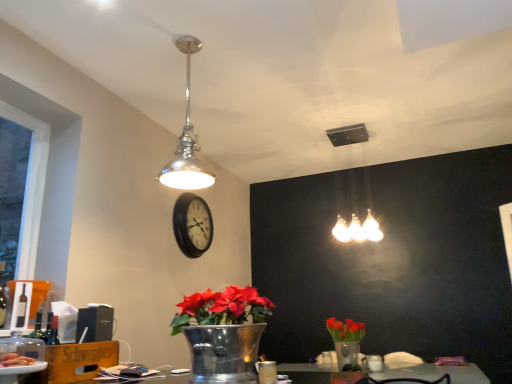
The height and width of the screenshot is (384, 512). Find the location of `polished chrome pendant light at upper center, positioned as the 1th lamp in front-to-back order`. polished chrome pendant light at upper center, positioned as the 1th lamp in front-to-back order is located at coordinates click(186, 137).

Measure the distance between point (x=191, y=49) and camera.

The depth of point (x=191, y=49) is 8.41 feet.

Measure the distance between metallic silver vase at lower center and camera.

metallic silver vase at lower center is 5.47 feet from camera.

The width and height of the screenshot is (512, 384). What do you see at coordinates (355, 216) in the screenshot?
I see `white frosted glass light fixture at upper center, which is counted as the 2th lamp, starting from the left` at bounding box center [355, 216].

This screenshot has height=384, width=512. Describe the element at coordinates (16, 360) in the screenshot. I see `translucent plastic plate at lower left` at that location.

At what (x,y) coordinates should I click in order to perform the action: click on black wooden clock at center. Please return your answer as a coordinate pair (x, y). Looking at the image, I should click on coord(192,225).

Which object is wider, polished chrome pendant light at upper center, marked as the 1th lamp in a left-to-right arrangement, or black wooden clock at center?

polished chrome pendant light at upper center, marked as the 1th lamp in a left-to-right arrangement.

Is polished chrome pendant light at upper center, marked as the 1th lamp in a left-to-right arrangement, at the left side of black wooden clock at center?

Incorrect, polished chrome pendant light at upper center, marked as the 1th lamp in a left-to-right arrangement, is not on the left side of black wooden clock at center.

Choose the correct answer: Is polished chrome pendant light at upper center, marked as the 1th lamp in a left-to-right arrangement, inside black wooden clock at center or outside it?

polished chrome pendant light at upper center, marked as the 1th lamp in a left-to-right arrangement, cannot be found inside black wooden clock at center.

At what (x,y) coordinates should I click in order to perform the action: click on clock directly beneath the polished chrome pendant light at upper center, positioned as the 2th lamp in back-to-front order (from a real-world perspective). Please return your answer as a coordinate pair (x, y). Looking at the image, I should click on (192, 225).

Is translucent plastic plate at lower left turned away from black wooden clock at center?

No, translucent plastic plate at lower left is not facing away from black wooden clock at center.

Is translucent plastic plate at lower left to the left of black wooden clock at center from the viewer's perspective?

Yes, translucent plastic plate at lower left is to the left of black wooden clock at center.

Is translucent plastic plate at lower left positioned in front of black wooden clock at center?

Yes, the depth of translucent plastic plate at lower left is less than that of black wooden clock at center.

Is metallic silver vase with red flowers at lower right spatially inside black wooden clock at center, or outside of it?

metallic silver vase with red flowers at lower right is not inside black wooden clock at center, it's outside.

From a real-world perspective, which is physically below, metallic silver vase with red flowers at lower right or black wooden clock at center?

In real-world perspective, metallic silver vase with red flowers at lower right is lower.

Locate an element on the screen. The height and width of the screenshot is (384, 512). floral arrangement below the black wooden clock at center (from the image's perspective) is located at coordinates (346, 342).

Is black wooden clock at center outside of white frosted glass light fixture at upper center, which is counted as the second lamp, starting from the front?

black wooden clock at center lies outside white frosted glass light fixture at upper center, which is counted as the second lamp, starting from the front,'s area.

From their relative heights in the image, would you say black wooden clock at center is taller or shorter than white frosted glass light fixture at upper center, which is counted as the second lamp, starting from the front?

black wooden clock at center is shorter than white frosted glass light fixture at upper center, which is counted as the second lamp, starting from the front.

Consider the image. Is black wooden clock at center to the left or to the right of white frosted glass light fixture at upper center, marked as the first lamp in a right-to-left arrangement, in the image?

black wooden clock at center is positioned on white frosted glass light fixture at upper center, marked as the first lamp in a right-to-left arrangement,'s left side.

How many degrees apart are the facing directions of polished chrome pendant light at upper center, marked as the 1th lamp in a left-to-right arrangement, and metallic silver vase at lower center?

They differ by 0.00197 degrees in their facing directions.

From a real-world perspective, which object rests below the other?

metallic silver vase at lower center, from a real-world perspective.

Does point (172, 163) come behind point (224, 310)?

That is True.

Which of these two, polished chrome pendant light at upper center, the second lamp from the right, or metallic silver vase at lower center, is thinner?

Thinner between the two is polished chrome pendant light at upper center, the second lamp from the right.

Are black wooden clock at center and translucent plastic plate at lower left beside each other?

No, black wooden clock at center is not making contact with translucent plastic plate at lower left.

Could you tell me if black wooden clock at center is turned towards translucent plastic plate at lower left?

No, black wooden clock at center is not turned towards translucent plastic plate at lower left.

Visually, is black wooden clock at center positioned to the left or to the right of translucent plastic plate at lower left?

black wooden clock at center is to the right of translucent plastic plate at lower left.

Where is `the 2nd lamp to the right of the black wooden clock at center, counting from the anchor's position`? the 2nd lamp to the right of the black wooden clock at center, counting from the anchor's position is located at coordinates (355, 216).

Looking at their sizes, would you say white frosted glass light fixture at upper center, which appears as the 1th lamp when viewed from the back, is wider or thinner than black wooden clock at center?

In the image, white frosted glass light fixture at upper center, which appears as the 1th lamp when viewed from the back, appears to be wider than black wooden clock at center.

Between white frosted glass light fixture at upper center, which is counted as the second lamp, starting from the front, and black wooden clock at center, which one has smaller size?

With smaller size is black wooden clock at center.

Consider the image. How different are the orientations of white frosted glass light fixture at upper center, marked as the first lamp in a right-to-left arrangement, and black wooden clock at center in degrees?

The angular difference between white frosted glass light fixture at upper center, marked as the first lamp in a right-to-left arrangement, and black wooden clock at center is 90.3 degrees.

You are a GUI agent. You are given a task and a screenshot of the screen. Output one action in this format:
    pyautogui.click(x=<x>, y=<y>)
    Task: Click on the clock located below the polished chrome pendant light at upper center, positioned as the 1th lamp in front-to-back order (from the image's perspective)
    This screenshot has height=384, width=512.
    Given the screenshot: What is the action you would take?
    pyautogui.click(x=192, y=225)

This screenshot has width=512, height=384. Identify the location of clock behind the translucent plastic plate at lower left. (192, 225).

Looking at the image, which one is located closer to white frosted glass light fixture at upper center, marked as the first lamp in a right-to-left arrangement, translucent plastic plate at lower left or metallic silver vase at lower center?

metallic silver vase at lower center is positioned closer to the anchor white frosted glass light fixture at upper center, marked as the first lamp in a right-to-left arrangement.

Considering their positions, is metallic silver vase with red flowers at lower right positioned further to polished chrome pendant light at upper center, the second lamp from the right, than white frosted glass light fixture at upper center, which is counted as the 2th lamp, starting from the left?

white frosted glass light fixture at upper center, which is counted as the 2th lamp, starting from the left, lies further to polished chrome pendant light at upper center, the second lamp from the right, than the other object.

From the image, which object appears to be farther from metallic silver vase at lower center, translucent plastic plate at lower left or white frosted glass light fixture at upper center, which appears as the 1th lamp when viewed from the back?

Based on the image, white frosted glass light fixture at upper center, which appears as the 1th lamp when viewed from the back, appears to be further to metallic silver vase at lower center.

Considering their positions, is metallic silver vase at lower center positioned closer to black wooden clock at center than metallic silver vase with red flowers at lower right?

The object closer to black wooden clock at center is metallic silver vase at lower center.

Considering their positions, is polished chrome pendant light at upper center, positioned as the 1th lamp in front-to-back order, positioned further to black wooden clock at center than white frosted glass light fixture at upper center, which is counted as the second lamp, starting from the front?

white frosted glass light fixture at upper center, which is counted as the second lamp, starting from the front.

Looking at the image, which one is located closer to metallic silver vase at lower center, black wooden clock at center or polished chrome pendant light at upper center, the second lamp from the right?

polished chrome pendant light at upper center, the second lamp from the right, is positioned closer to the anchor metallic silver vase at lower center.

Estimate the real-world distances between objects in this image. Which object is closer to metallic silver vase at lower center, metallic silver vase with red flowers at lower right or translucent plastic plate at lower left?

translucent plastic plate at lower left lies closer to metallic silver vase at lower center than the other object.

Based on the photo, based on their spatial positions, is polished chrome pendant light at upper center, positioned as the 2th lamp in back-to-front order, or metallic silver vase with red flowers at lower right further from white frosted glass light fixture at upper center, which appears as the 1th lamp when viewed from the back?

polished chrome pendant light at upper center, positioned as the 2th lamp in back-to-front order, is further to white frosted glass light fixture at upper center, which appears as the 1th lamp when viewed from the back.

I want to click on houseplant between translucent plastic plate at lower left and metallic silver vase with red flowers at lower right in the horizontal direction, so click(223, 332).

Where is `lamp between polished chrome pendant light at upper center, the second lamp from the right, and metallic silver vase with red flowers at lower right from top to bottom`? The image size is (512, 384). lamp between polished chrome pendant light at upper center, the second lamp from the right, and metallic silver vase with red flowers at lower right from top to bottom is located at coordinates (355, 216).

Identify the location of floral arrangement between metallic silver vase at lower center and black wooden clock at center from front to back. (346, 342).

This screenshot has width=512, height=384. I want to click on clock between polished chrome pendant light at upper center, positioned as the 1th lamp in front-to-back order, and metallic silver vase with red flowers at lower right in the up-down direction, so click(192, 225).